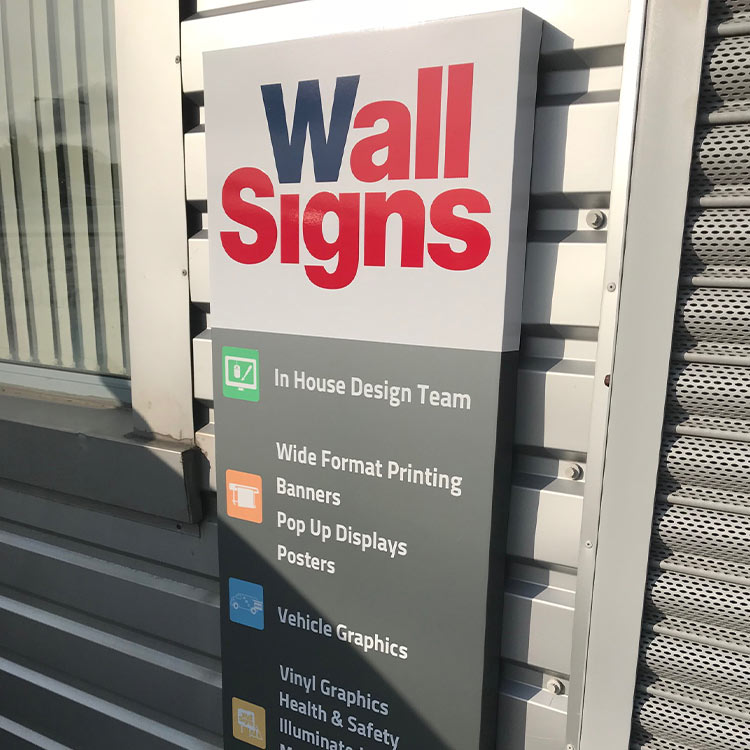
Locate an element on the screen. washer is located at coordinates (x=556, y=682).